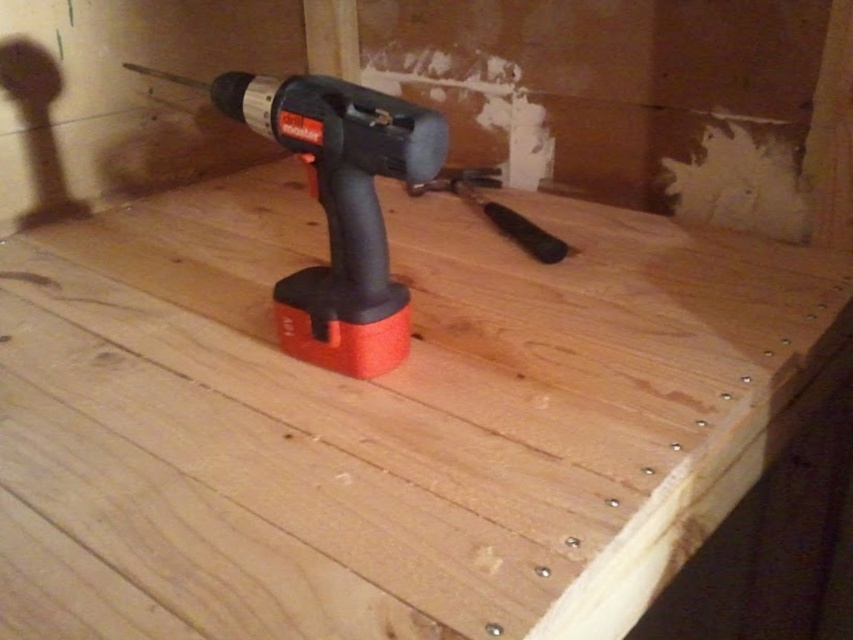
You are standing in front of a wooden table at center where a cordless drill is placed. There is a specific point marked at coordinates (386, 419). Can you tell me where this point is located relative to the wooden table at center?

The point (386, 419) is located on the wooden table at center.